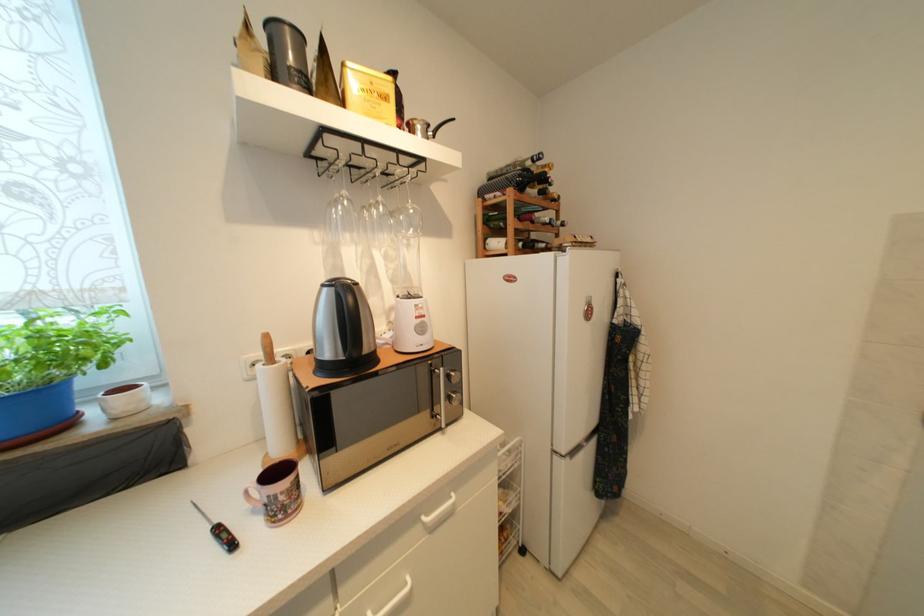
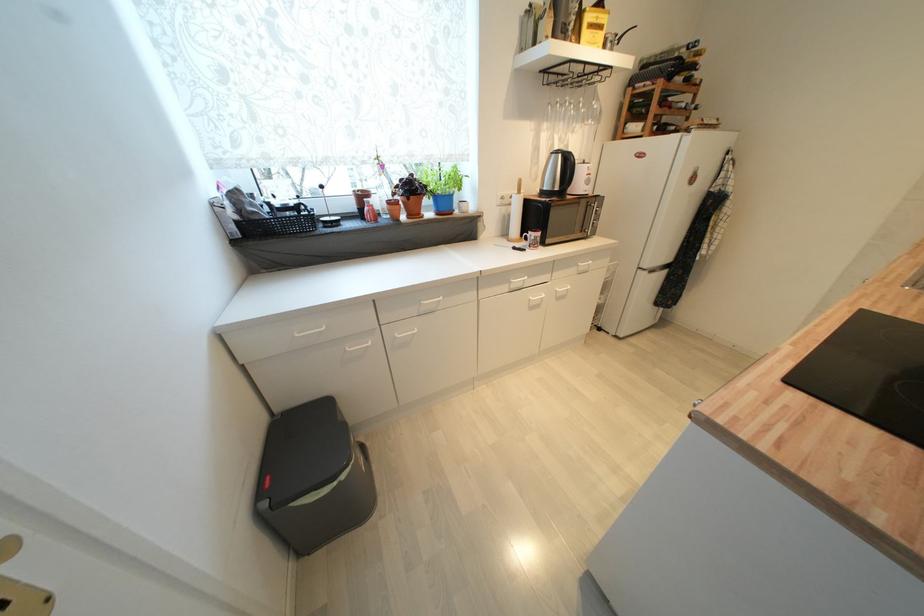
The point at (x=237, y=546) is marked in the first image. Where is the corresponding point in the second image?

(529, 252)